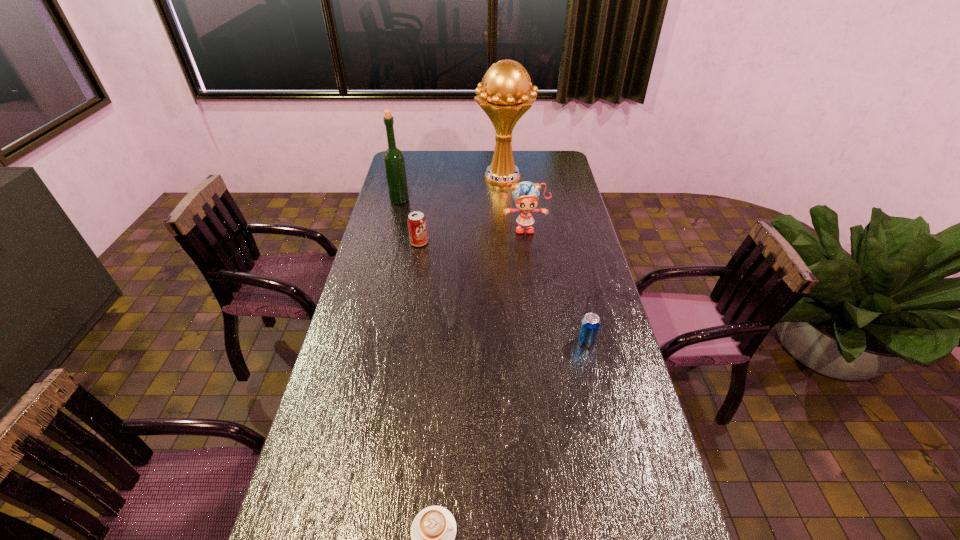
Where is `free space located at the front of the trophy_cup where the globe is prominent`? free space located at the front of the trophy_cup where the globe is prominent is located at coordinates (508, 240).

The image size is (960, 540). Identify the location of blank space located 0.320m on the front of the fifth shortest object. (387, 251).

Find the location of `free spot located on the face of the doll`. free spot located on the face of the doll is located at coordinates (525, 244).

Locate an element on the screen. This screenshot has height=540, width=960. free space located on the front of the soda can is located at coordinates (412, 288).

I want to click on vacant region located on the left of the second shortest object, so click(488, 342).

The height and width of the screenshot is (540, 960). In order to click on object situated at the far edge in this screenshot , I will do `click(503, 94)`.

Locate an element on the screen. liquor positioned at the left edge is located at coordinates (394, 163).

The height and width of the screenshot is (540, 960). Find the location of `soda can positioned at the left edge`. soda can positioned at the left edge is located at coordinates (417, 227).

You are a GUI agent. You are given a task and a screenshot of the screen. Output one action in this format:
    pyautogui.click(x=<x>, y=<y>)
    Task: Click on the doll situated at the right edge
    
    Given the screenshot: What is the action you would take?
    pyautogui.click(x=525, y=194)

Find the location of a particular element. beer can present at the right edge is located at coordinates (590, 323).